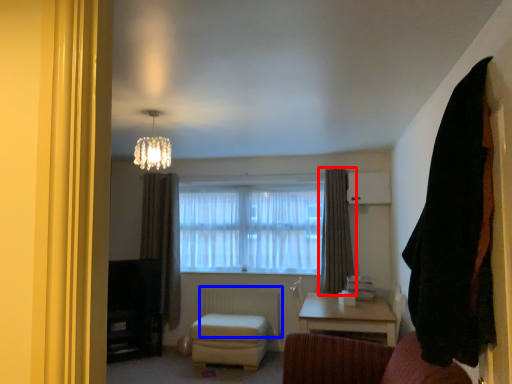
Question: Which point is closer to the camera, curtain (highlighted by a red box) or radiator (highlighted by a blue box)?

Choices:
 (A) curtain
 (B) radiator

Answer: (A)